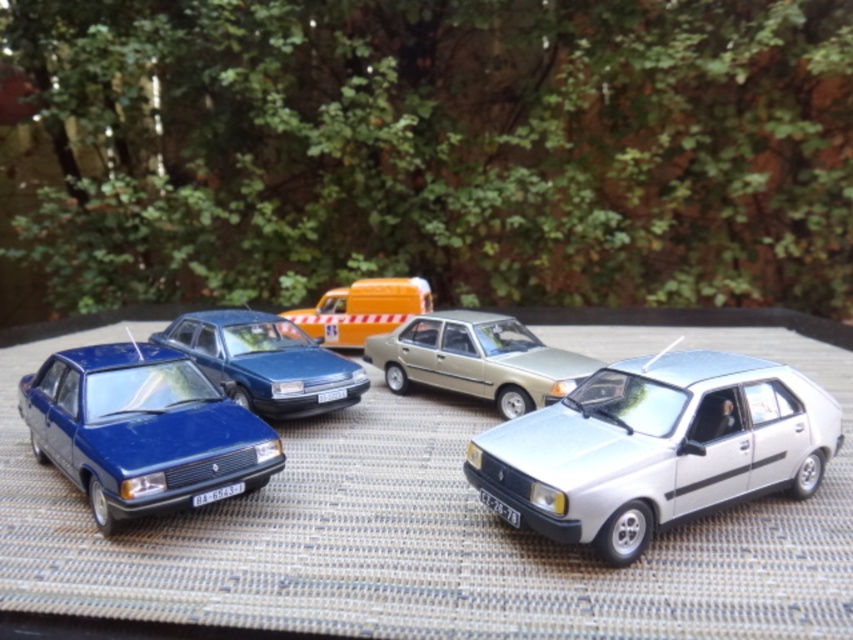
Does silver metallic hatchback at lower right appear on the left side of yellow matte van at center?

Incorrect, silver metallic hatchback at lower right is not on the left side of yellow matte van at center.

Can you confirm if silver metallic hatchback at lower right is positioned above yellow matte van at center?

No.

The image size is (853, 640). Find the location of `silver metallic hatchback at lower right`. silver metallic hatchback at lower right is located at coordinates (654, 448).

Between metallic gold sedan at center and yellow matte van at center, which one is positioned higher?

yellow matte van at center is higher up.

Who is more forward, (405, 385) or (370, 282)?

Point (405, 385) is more forward.

You are a GUI agent. You are given a task and a screenshot of the screen. Output one action in this format:
    pyautogui.click(x=<x>, y=<y>)
    Task: Click on the metallic gold sedan at center
    The width and height of the screenshot is (853, 640).
    Given the screenshot: What is the action you would take?
    pyautogui.click(x=477, y=358)

Can you confirm if silver metallic hatchback at lower right is thinner than metallic gold sedan at center?

Incorrect, silver metallic hatchback at lower right's width is not less than metallic gold sedan at center's.

Which is more to the right, silver metallic hatchback at lower right or metallic gold sedan at center?

silver metallic hatchback at lower right is more to the right.

Measure the distance between silver metallic hatchback at lower right and camera.

silver metallic hatchback at lower right is 1.49 meters from camera.

I want to click on silver metallic hatchback at lower right, so click(654, 448).